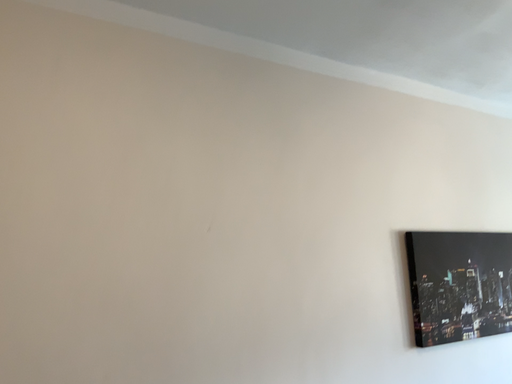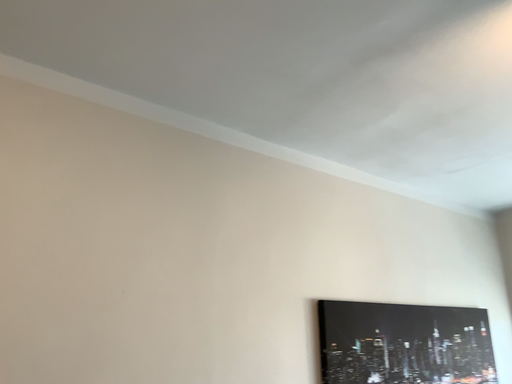
Question: Which way did the camera rotate in the video?

Choices:
 (A) rotated upward
 (B) rotated downward

Answer: (A)